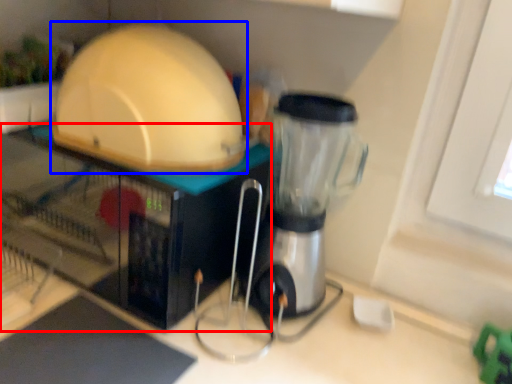
Question: Which object is further to the camera taking this photo, appliance (highlighted by a red box) or appliance (highlighted by a blue box)?

Choices:
 (A) appliance
 (B) appliance

Answer: (A)